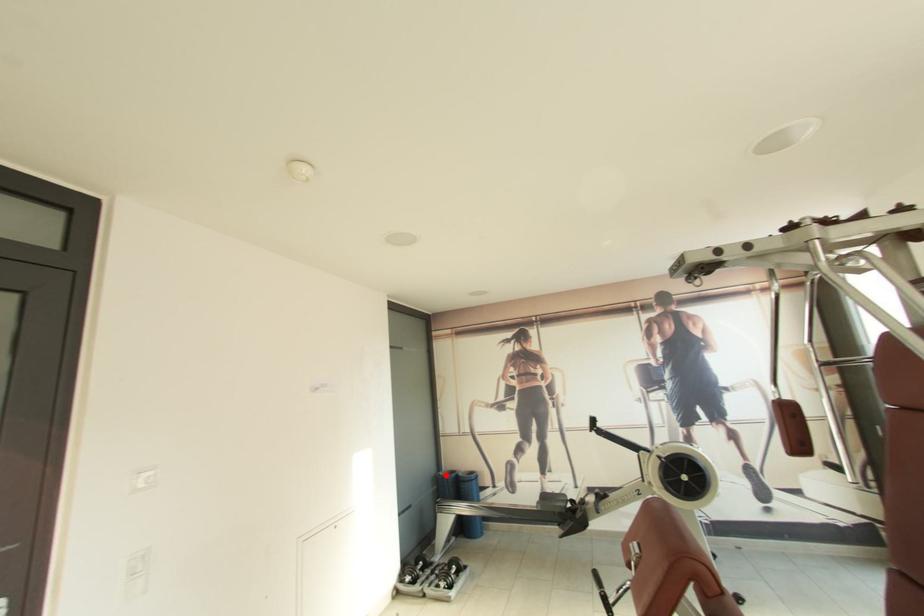
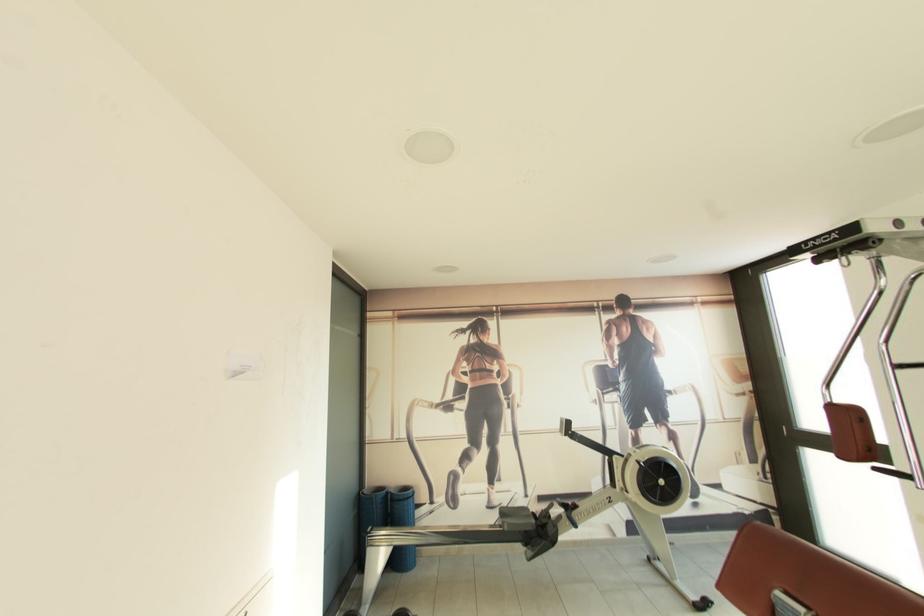
Question: I am providing you with two images of the same scene from different viewpoints. Given a red point in image1, look at the same physical point in image2. Is it:

Choices:
 (A) Closer to the viewpoint
 (B) Farther from the viewpoint

Answer: (A)